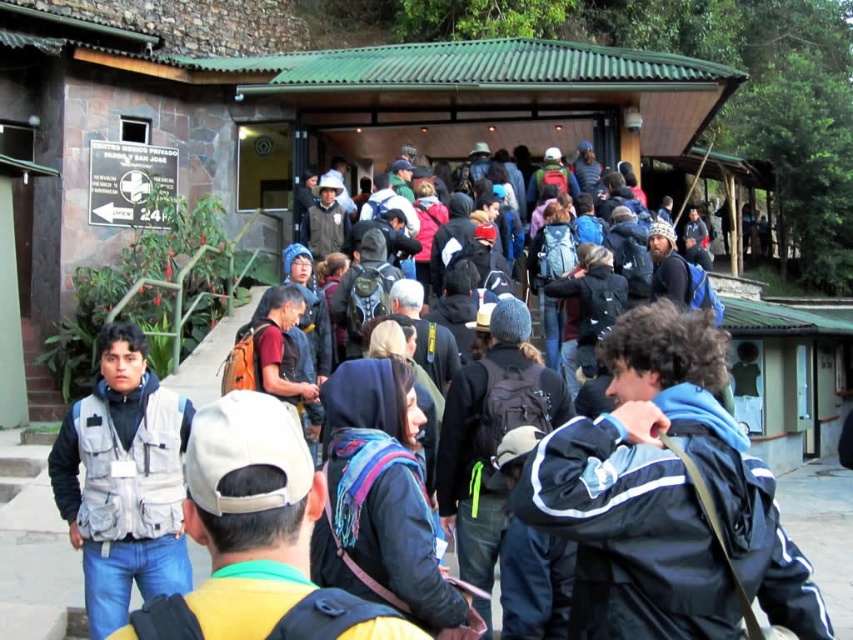
In the scene shown: You are a photographer standing at the entrance of the building. You want to take a photo of the blue fabric jacket at center and the signboard on the left side of the building. How far apart are these two objects in the scene?

The blue fabric jacket at center and the signboard on the left side of the building are 38.92 feet apart.

Consider the image. You are standing in front of the building with the green corrugated metal roof and stone walls. There are two points marked in the scene. The first point is at coordinates point (x=706, y=596) and the second is at point (x=442, y=499). Which of these two points is closer to you?

Point (x=706, y=596) is closer to the viewer than point (x=442, y=499).

You are a photographer standing in front of the building with the green corrugated metal roof. You notice the blue fabric jacket at center and the dark blue backpack at center. Which object is shorter in height?

The blue fabric jacket at center has a lesser height compared to the dark blue backpack at center, so the blue fabric jacket at center is shorter in height.